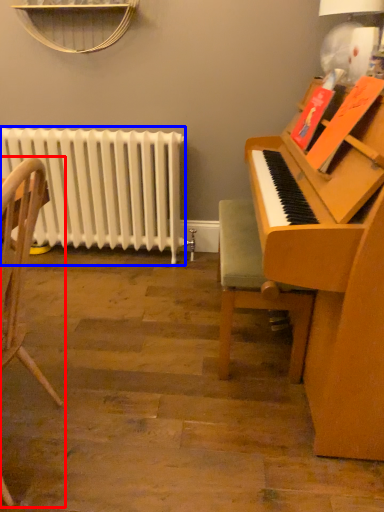
Question: Among these objects, which one is nearest to the camera, chair (highlighted by a red box) or radiator (highlighted by a blue box)?

Choices:
 (A) chair
 (B) radiator

Answer: (A)